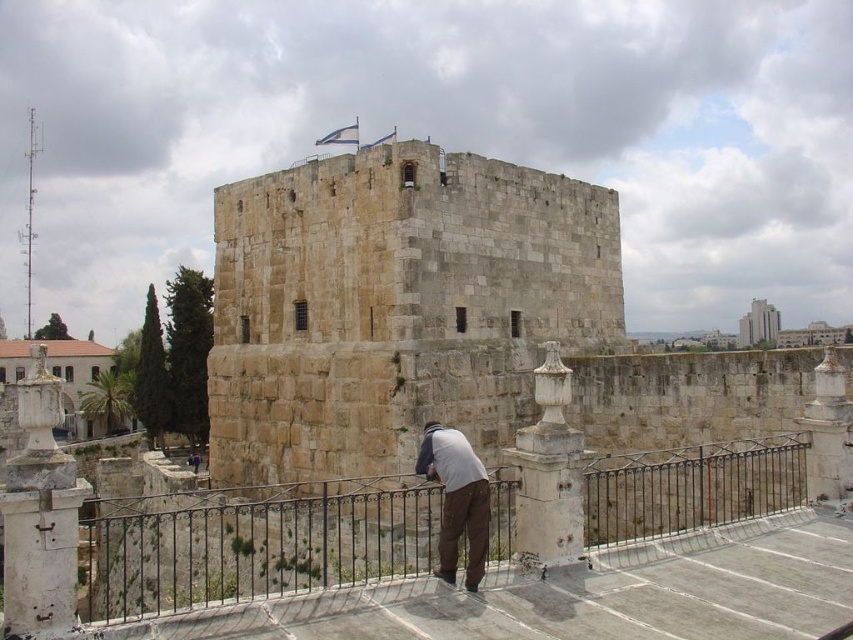
You are standing on the paved walkway and want to take a photo of the stone tower at center. To ensure the light gray fabric shirt at lower center is not in the frame, should you move to the left or right of the walkway?

The stone tower at center is positioned on the right side of light gray fabric shirt at lower center. To avoid including the light gray fabric shirt at lower center in the photo, you should move to the right side of the walkway so that the tower is framed without the shirt in the shot.

Consider the image. Based on the scene description, what is the 2D coordinate position of the stone tower at center?

The stone tower at center is located at the 2D coordinate point of (x=442, y=321).